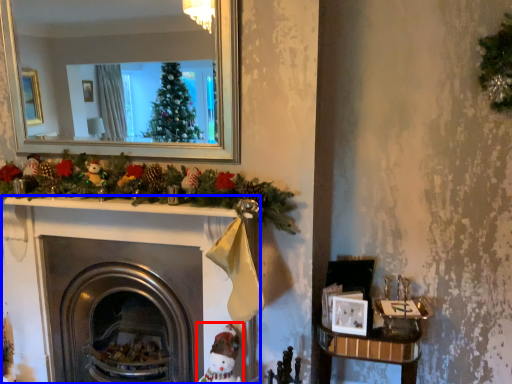
Question: Among these objects, which one is nearest to the camera, toy (highlighted by a red box) or fireplace (highlighted by a blue box)?

Choices:
 (A) toy
 (B) fireplace

Answer: (A)